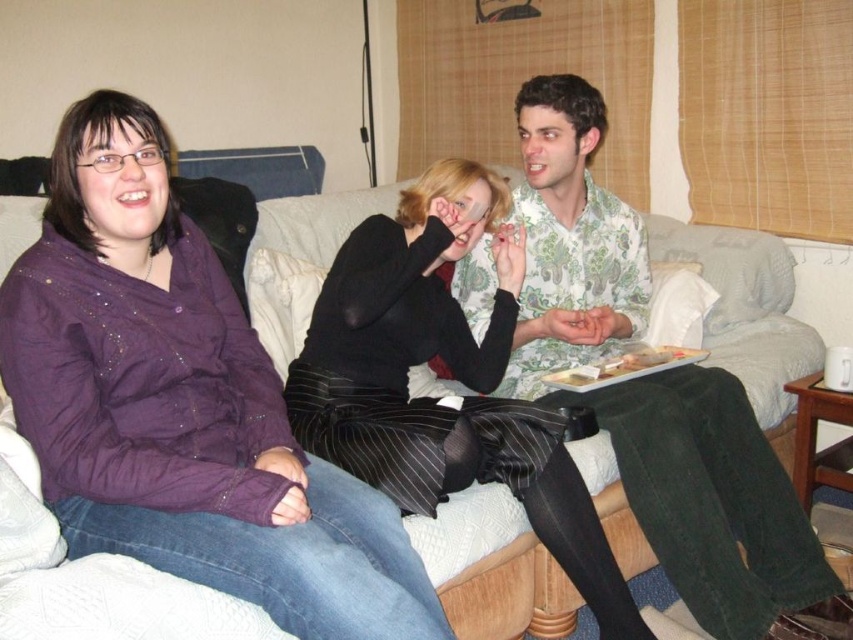
In the scene shown: Is black pinstripe pants at center smaller than white fabric couch at upper left?

No, black pinstripe pants at center is not smaller than white fabric couch at upper left.

Who is more forward, (x=579, y=529) or (x=80, y=579)?

Point (x=80, y=579) is in front.

I want to click on black pinstripe pants at center, so click(x=451, y=374).

Is floral cotton shirt at center wider than white fabric couch at upper left?

Yes, floral cotton shirt at center is wider than white fabric couch at upper left.

Identify the location of floral cotton shirt at center. (654, 394).

Does point (584, 150) come in front of point (546, 508)?

No, (584, 150) is behind (546, 508).

The image size is (853, 640). Find the location of `floral cotton shirt at center`. floral cotton shirt at center is located at coordinates (654, 394).